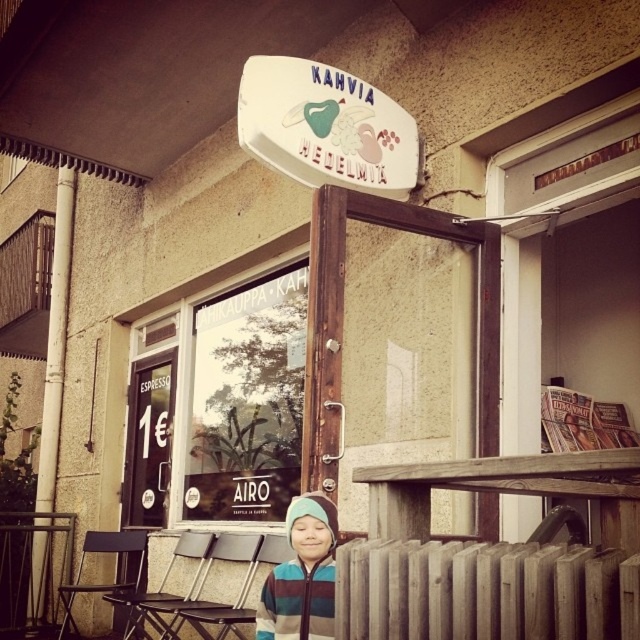
You are a customer entering the Kahvia Medelmita cafe and see both the striped fleece jacket at center and the metallic silver chair at center. Which object is taller?

The metallic silver chair at center is taller than the striped fleece jacket at center.

You are a customer entering the Kahvia Medelmita cafe and notice two items outside the entrance. Which item is bigger in size between the white plastic sign at upper center and the striped fleece jacket at center?

The white plastic sign at upper center is larger in size compared to the striped fleece jacket at center.